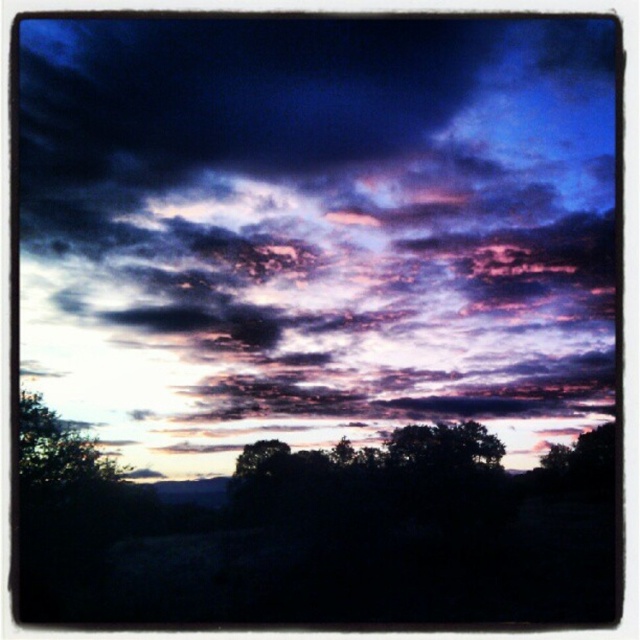
Question: Among these points, which one is farthest from the camera?

Choices:
 (A) (56, 484)
 (B) (417, 460)
 (C) (477, 65)

Answer: (B)

Question: Among these objects, which one is farthest from the camera?

Choices:
 (A) dark green leafy tree at center
 (B) purple cotton clouds at upper center

Answer: (A)

Question: Does purple cotton clouds at upper center have a lesser width compared to green leafy tree at lower left?

Choices:
 (A) yes
 (B) no

Answer: (B)

Question: Is the position of purple cotton clouds at upper center more distant than that of dark green leafy tree at center?

Choices:
 (A) yes
 (B) no

Answer: (B)

Question: Which point appears closest to the camera in this image?

Choices:
 (A) (74, 470)
 (B) (419, 435)
 (C) (100, 273)

Answer: (A)

Question: Is green leafy tree at lower left in front of dark green leafy tree at center?

Choices:
 (A) no
 (B) yes

Answer: (B)